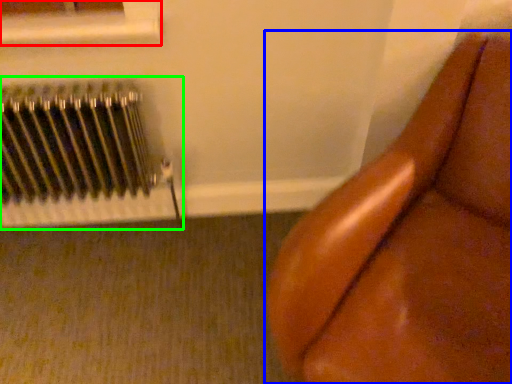
Question: Estimate the real-world distances between objects in this image. Which object is farther from window frame (highlighted by a red box), furniture (highlighted by a blue box) or radiator (highlighted by a green box)?

Choices:
 (A) furniture
 (B) radiator

Answer: (A)